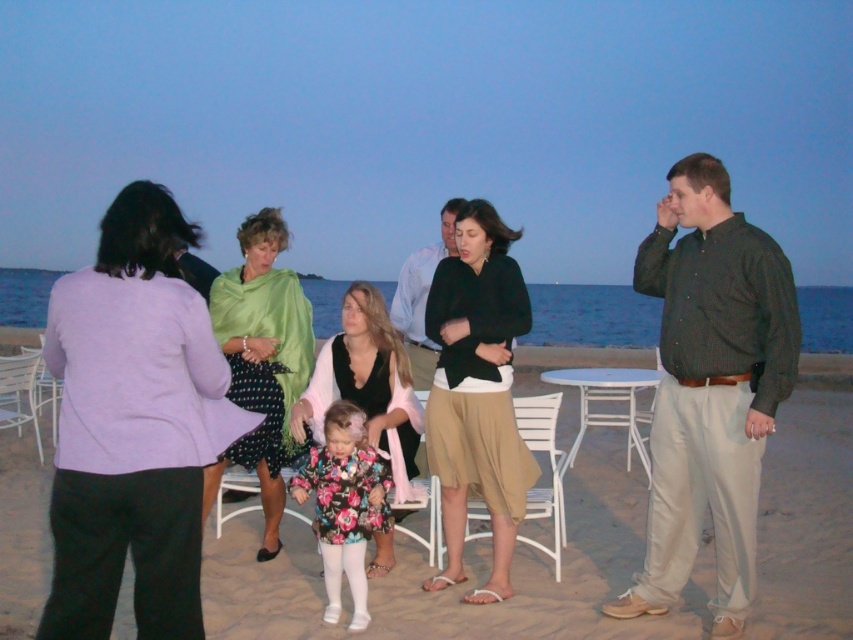
From the picture: You are a fashion designer observing the image. You need to decide which item would be better suited for a slimming outfit. Based on their thickness, would you choose the black matte skirt at center or the green satin shawl at center?

The black matte skirt at center is thinner than the green satin shawl at center, so it would be better suited for a slimming outfit.

You are standing at the center of the beach scene. There is a green satin shawl at center. Where exactly is the green satin shawl located in terms of coordinates?

The green satin shawl at center is located at coordinates point (262, 362).